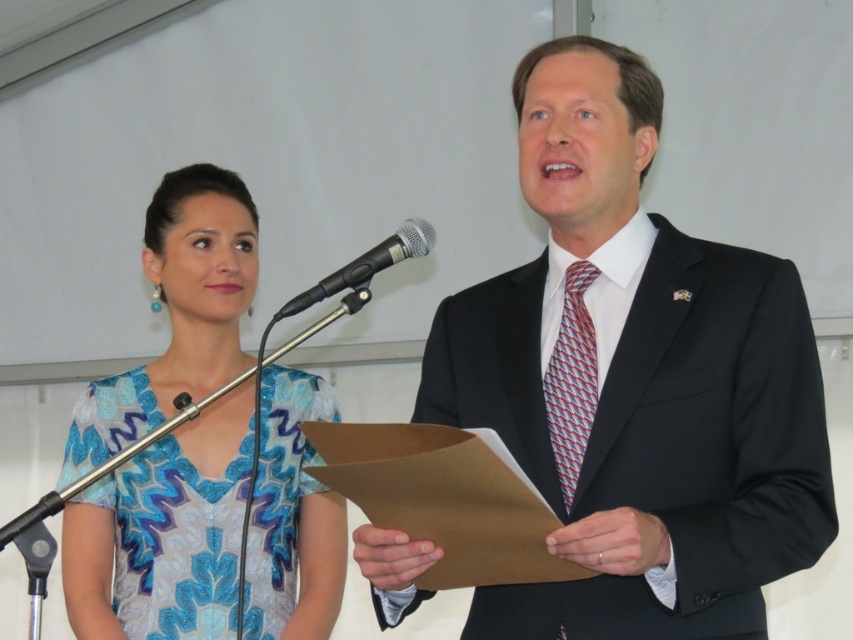
Where is `black suit at center`? black suit at center is located at coordinates (635, 381).

Does black suit at center appear on the left side of black metallic microphone at center?

Incorrect, black suit at center is not on the left side of black metallic microphone at center.

Where is `black suit at center`? The width and height of the screenshot is (853, 640). black suit at center is located at coordinates (635, 381).

Which is more to the right, shiny blue dress at center or black metallic microphone at center?

black metallic microphone at center

Between point (169, 609) and point (387, 244), which one is positioned in front?

Point (387, 244) is in front.

I want to click on shiny blue dress at center, so [x=164, y=532].

Can you confirm if black suit at center is taller than shiny blue dress at center?

Incorrect, black suit at center's height is not larger of shiny blue dress at center's.

Between point (811, 340) and point (183, 324), which one is positioned behind?

Point (183, 324)

This screenshot has width=853, height=640. Identify the location of black suit at center. (635, 381).

Image resolution: width=853 pixels, height=640 pixels. In order to click on black suit at center in this screenshot , I will do `click(635, 381)`.